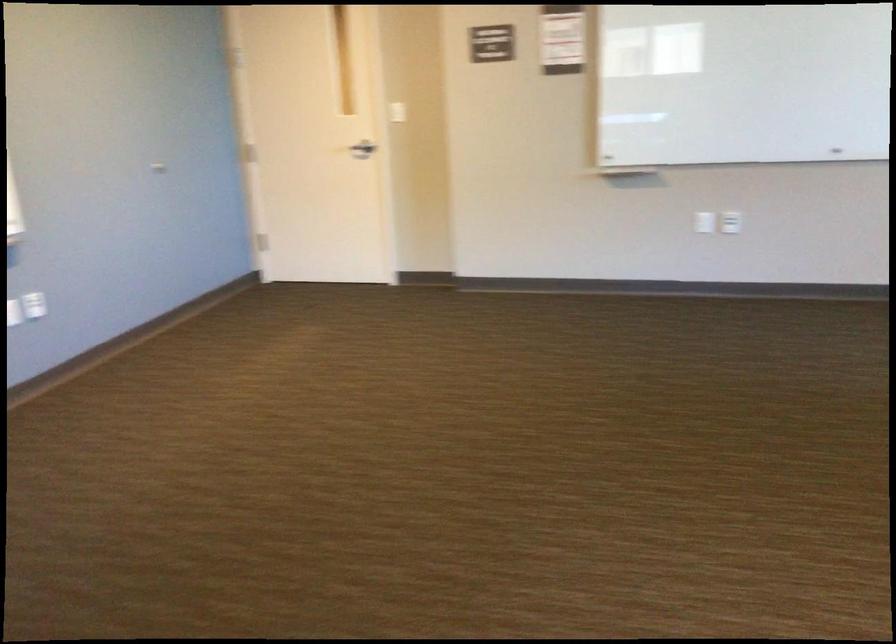
Where would you plac the whiteboard marker tray? Please return your answer as a coordinate pair (x, y).

(711, 164)